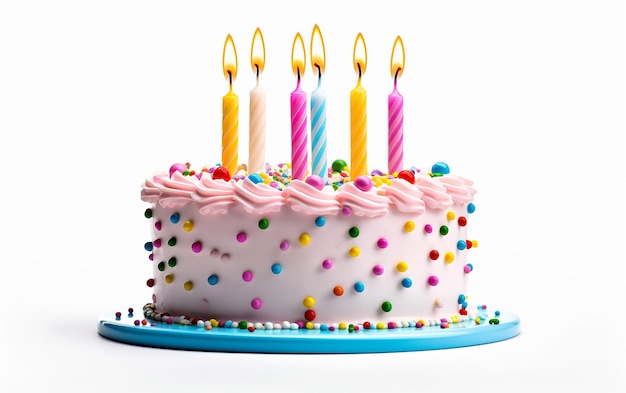
Locate an element on the screen. This screenshot has height=393, width=626. candles is located at coordinates (226, 123), (255, 129), (298, 147), (322, 134), (361, 140), (397, 131).